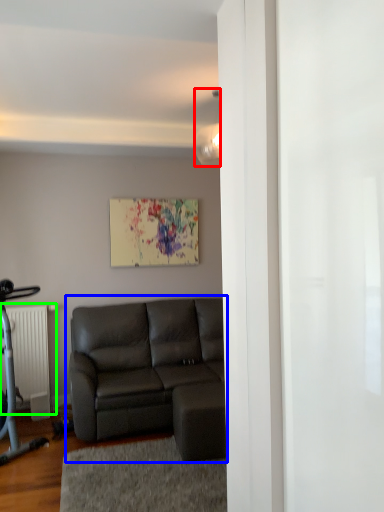
Question: Considering the real-world distances, which object is farthest from light fixture (highlighted by a red box)? studio couch (highlighted by a blue box) or radiator (highlighted by a green box)?

Choices:
 (A) studio couch
 (B) radiator

Answer: (B)